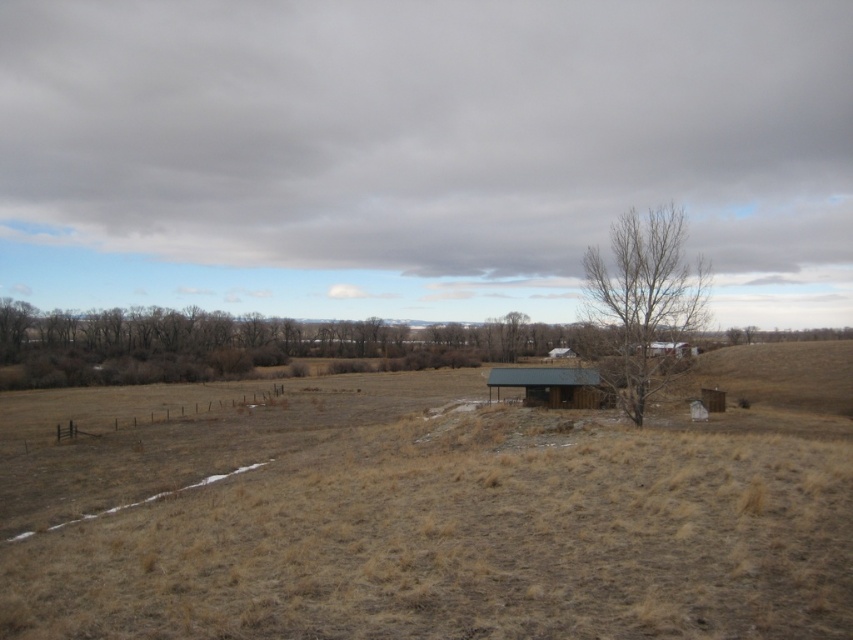
At what (x,y) coordinates should I click in order to perform the action: click on dry grass at center. Please return your answer as a coordinate pair (x, y). The height and width of the screenshot is (640, 853). Looking at the image, I should click on (434, 509).

Between point (381, 625) and point (598, 381), which one is positioned in front?

Point (381, 625) is in front.

The width and height of the screenshot is (853, 640). What are the coordinates of `dry grass at center` in the screenshot? It's located at (434, 509).

Which of these two, dry grass at center or bare wood tree at center, stands shorter?

dry grass at center

Does point (178, 572) come in front of point (587, 250)?

Yes, point (178, 572) is closer to viewer.

Between point (413, 452) and point (676, 364), which one is positioned in front?

Positioned in front is point (413, 452).

Find the location of a particular element. dry grass at center is located at coordinates (434, 509).

Is the position of bare wood tree at center more distant than that of brown wooden cabin at center?

No, bare wood tree at center is closer to the viewer.

Identify the location of bare wood tree at center. The image size is (853, 640). (643, 304).